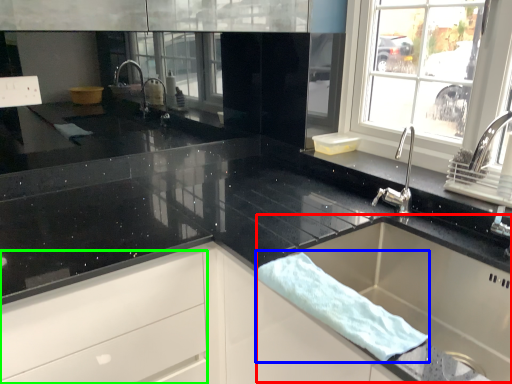
Question: Considering the real-world distances, which object is closest to sink (highlighted by a red box)? bath towel (highlighted by a blue box) or drawer (highlighted by a green box).

Choices:
 (A) bath towel
 (B) drawer

Answer: (A)